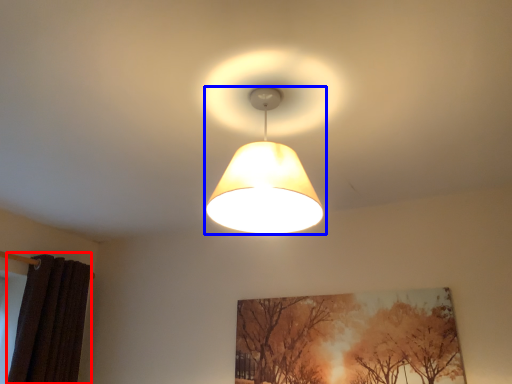
Question: Which point is closer to the camera, curtain (highlighted by a red box) or lamp (highlighted by a blue box)?

Choices:
 (A) curtain
 (B) lamp

Answer: (B)